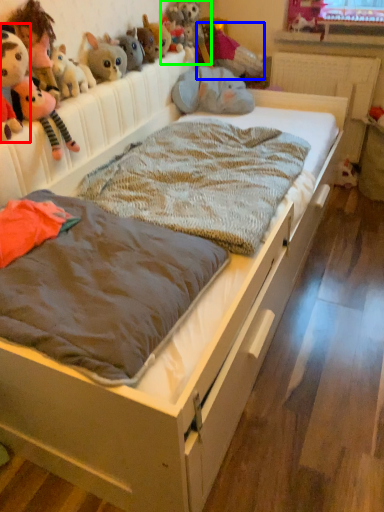
Question: Which is farther away from toy (highlighted by a red box)? toy (highlighted by a blue box) or toy (highlighted by a green box)?

Choices:
 (A) toy
 (B) toy

Answer: (A)